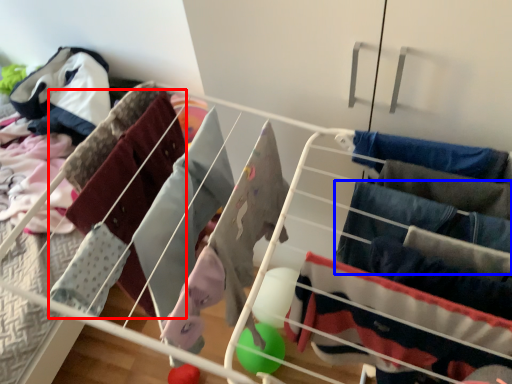
Question: Which object is further to the camera taking this photo, clothing (highlighted by a red box) or clothing (highlighted by a blue box)?

Choices:
 (A) clothing
 (B) clothing

Answer: (A)